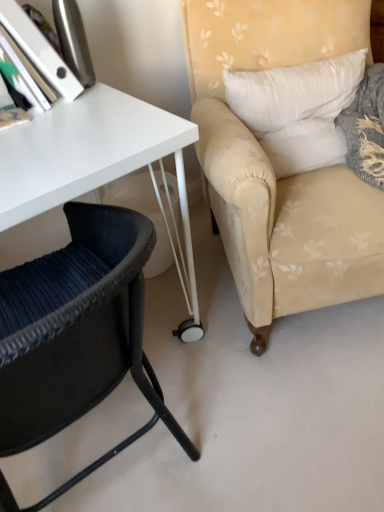
Question: Is black woven chair at lower left, arranged as the 2th chair when viewed from the right, facing towards beige floral fabric armchair at right, which is counted as the 1th chair, starting from the right?

Choices:
 (A) yes
 (B) no

Answer: (B)

Question: Does black woven chair at lower left, arranged as the 2th chair when viewed from the right, have a lesser height compared to beige floral fabric armchair at right, which is the second chair in left-to-right order?

Choices:
 (A) no
 (B) yes

Answer: (B)

Question: Is black woven chair at lower left, which ranks as the 1th chair in left-to-right order, further to the viewer compared to beige floral fabric armchair at right, which is the second chair in left-to-right order?

Choices:
 (A) no
 (B) yes

Answer: (A)

Question: From the image's perspective, is black woven chair at lower left, which ranks as the 1th chair in left-to-right order, under beige floral fabric armchair at right, which is the second chair in left-to-right order?

Choices:
 (A) yes
 (B) no

Answer: (A)

Question: Is black woven chair at lower left, arranged as the 2th chair when viewed from the right, placed right next to beige floral fabric armchair at right, which is the second chair in left-to-right order?

Choices:
 (A) yes
 (B) no

Answer: (B)

Question: Is black woven chair at lower left, which ranks as the 1th chair in left-to-right order, inside the boundaries of beige floral fabric armchair at right, which is the second chair in left-to-right order, or outside?

Choices:
 (A) outside
 (B) inside

Answer: (A)

Question: From the image's perspective, is black woven chair at lower left, which ranks as the 1th chair in left-to-right order, positioned above or below beige floral fabric armchair at right, which is counted as the 1th chair, starting from the right?

Choices:
 (A) above
 (B) below

Answer: (B)

Question: Is point (127, 343) positioned closer to the camera than point (334, 224)?

Choices:
 (A) closer
 (B) farther

Answer: (A)

Question: Considering their positions, is black woven chair at lower left, which ranks as the 1th chair in left-to-right order, located in front of or behind beige floral fabric armchair at right, which is counted as the 1th chair, starting from the right?

Choices:
 (A) behind
 (B) front

Answer: (B)

Question: Is white fabric pillow at upper right taller or shorter than black woven chair at lower left, which ranks as the 1th chair in left-to-right order?

Choices:
 (A) short
 (B) tall

Answer: (A)

Question: Is white fabric pillow at upper right wider or thinner than black woven chair at lower left, which ranks as the 1th chair in left-to-right order?

Choices:
 (A) thin
 (B) wide

Answer: (A)

Question: From a real-world perspective, is white fabric pillow at upper right above or below black woven chair at lower left, arranged as the 2th chair when viewed from the right?

Choices:
 (A) above
 (B) below

Answer: (A)

Question: Would you say white fabric pillow at upper right is to the left or to the right of black woven chair at lower left, which ranks as the 1th chair in left-to-right order, in the picture?

Choices:
 (A) left
 (B) right

Answer: (B)

Question: Visually, is black woven chair at lower left, which ranks as the 1th chair in left-to-right order, positioned to the left or to the right of white fabric pillow at upper right?

Choices:
 (A) right
 (B) left

Answer: (B)

Question: In terms of size, does black woven chair at lower left, which ranks as the 1th chair in left-to-right order, appear bigger or smaller than white fabric pillow at upper right?

Choices:
 (A) big
 (B) small

Answer: (A)